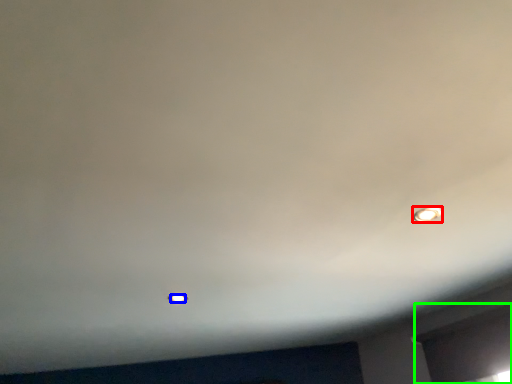
Question: Which is farther away from light bulb (highlighted by a red box)? light bulb (highlighted by a blue box) or window (highlighted by a green box)?

Choices:
 (A) light bulb
 (B) window

Answer: (A)